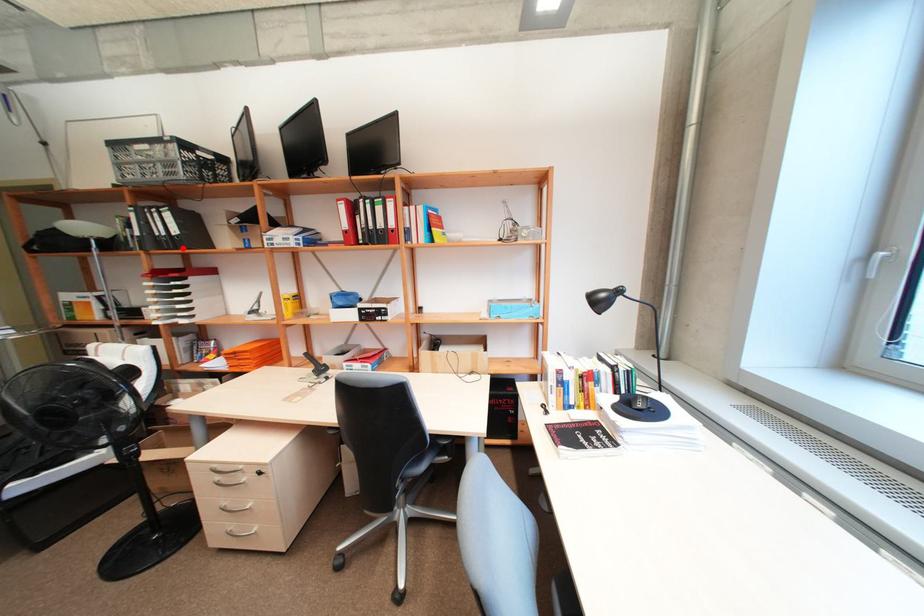
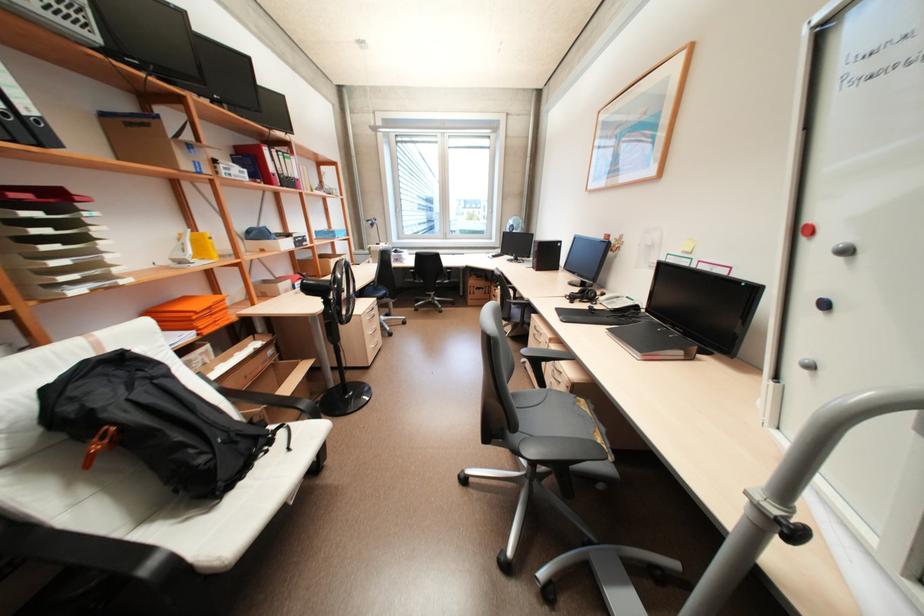
In the second image, find the point that corresponds to the highlighted location in the first image.

(46, 146)